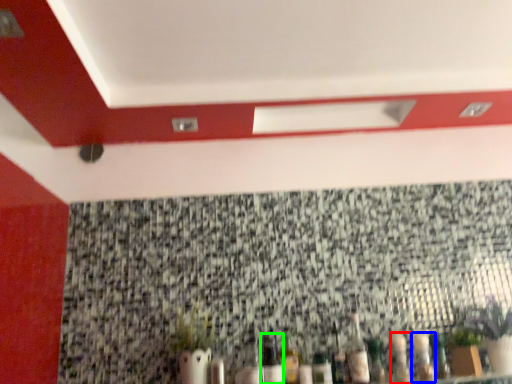
Question: Estimate the real-world distances between objects in this image. Which object is farther from bottle (highlighted by a red box), bottle (highlighted by a blue box) or bottle (highlighted by a green box)?

Choices:
 (A) bottle
 (B) bottle

Answer: (B)